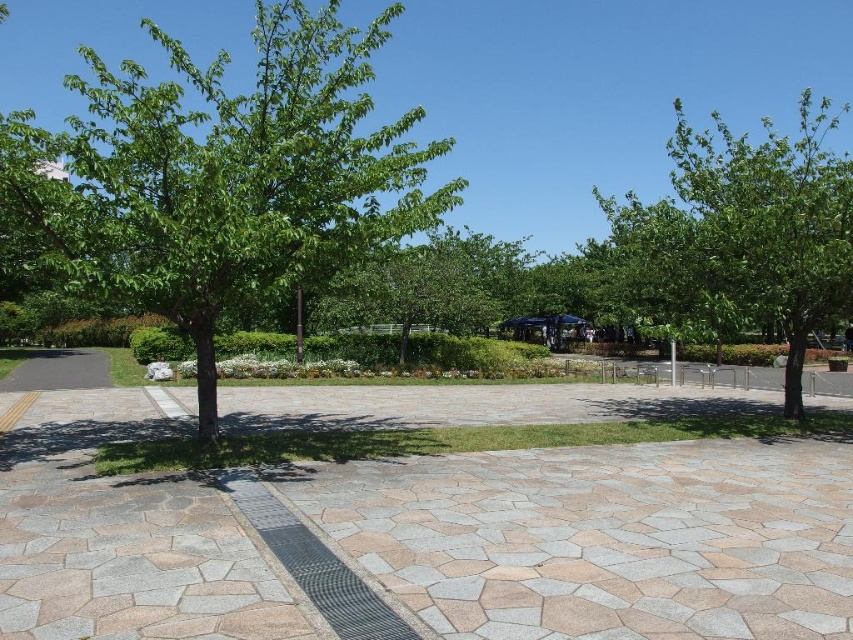
Looking at this image, you are a gardener planning to water the green leafy tree at left and the metallic gray path at center. Since the path is metallic, it might heat up in the sun. Which object should you water first to prevent it from getting too hot?

The metallic gray path at center heats up more quickly under the sun, so you should water it first to prevent overheating. The green leafy tree at left is located above the path, but trees generally don not require watering as frequently as heated surfaces.

You are a gardener planning to plant a new tree in the park. The existing green leafy tree at right and the metallic gray path at center are both in your current view. Considering their sizes, which object would require more space for planting?

The green leafy tree at right has a larger size compared to the metallic gray path at center, so planting a new tree of similar size would require more space than the path.